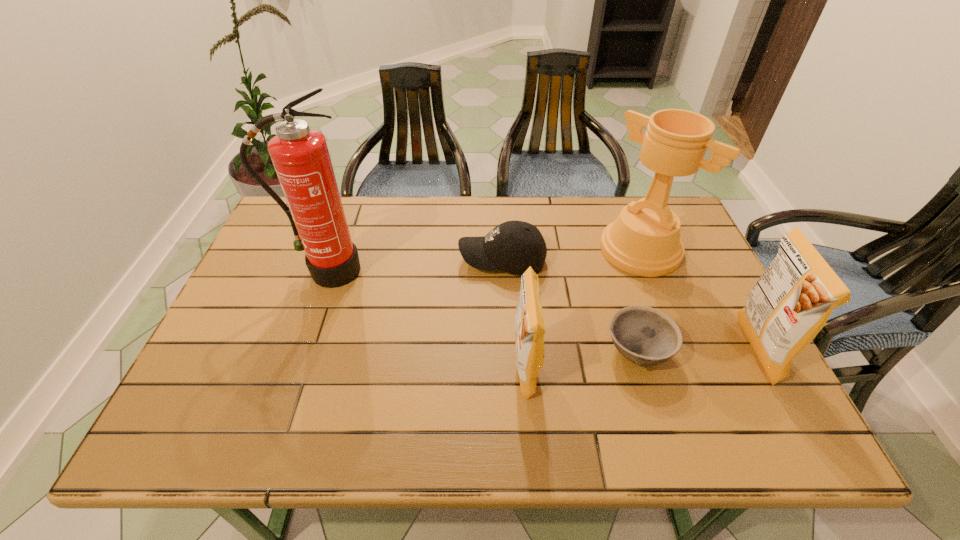
You are a GUI agent. You are given a task and a screenshot of the screen. Output one action in this format:
    pyautogui.click(x=<x>, y=<y>)
    Task: Click on the vacant space located on the front-facing side of the fifth tallest object
    Image resolution: width=960 pixels, height=540 pixels.
    Given the screenshot: What is the action you would take?
    pyautogui.click(x=343, y=260)

At what (x,y) coordinates should I click in order to perform the action: click on vacant area situated 0.390m on the front-facing side of the fifth tallest object. Please return your answer as a coordinate pair (x, y). Image resolution: width=960 pixels, height=540 pixels. Looking at the image, I should click on (322, 260).

Find the location of a particular element. vacant space located on the front-facing side of the fifth tallest object is located at coordinates (360, 260).

This screenshot has width=960, height=540. What are the coordinates of `vacant space located on the front-facing side of the fire extinguisher` in the screenshot? It's located at (312, 315).

This screenshot has height=540, width=960. What are the coordinates of `vacant space located 0.130m on the front of the fifth shortest object` in the screenshot? It's located at (665, 314).

Where is `free space located on the left of the shortest object`? free space located on the left of the shortest object is located at coordinates (578, 351).

Where is `baseball cap at the far edge`? baseball cap at the far edge is located at coordinates [x=513, y=246].

Where is `award that is at the far edge`? award that is at the far edge is located at coordinates (644, 240).

Where is `bowl that is at the near edge`? Image resolution: width=960 pixels, height=540 pixels. bowl that is at the near edge is located at coordinates (643, 335).

In order to click on object at the left edge in this screenshot , I will do click(300, 156).